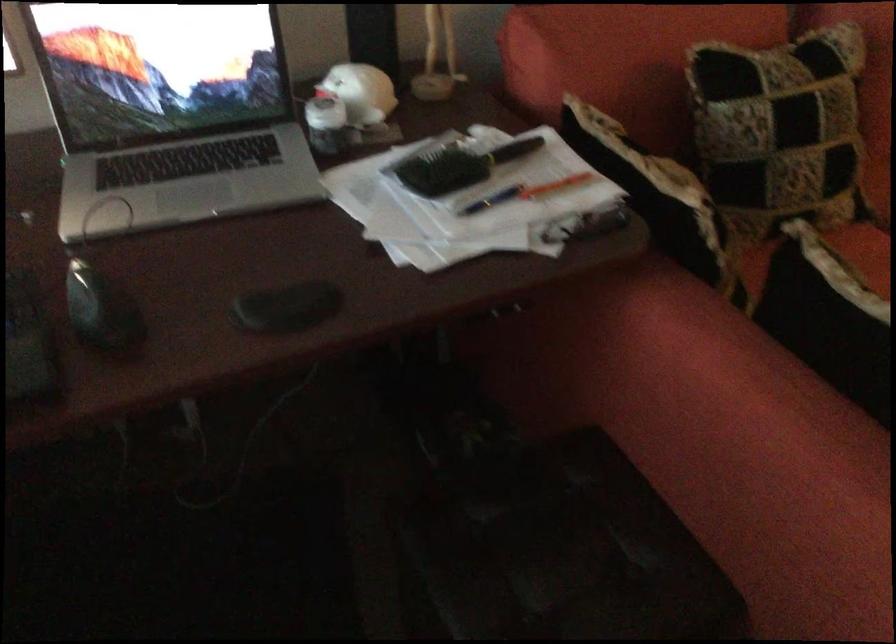
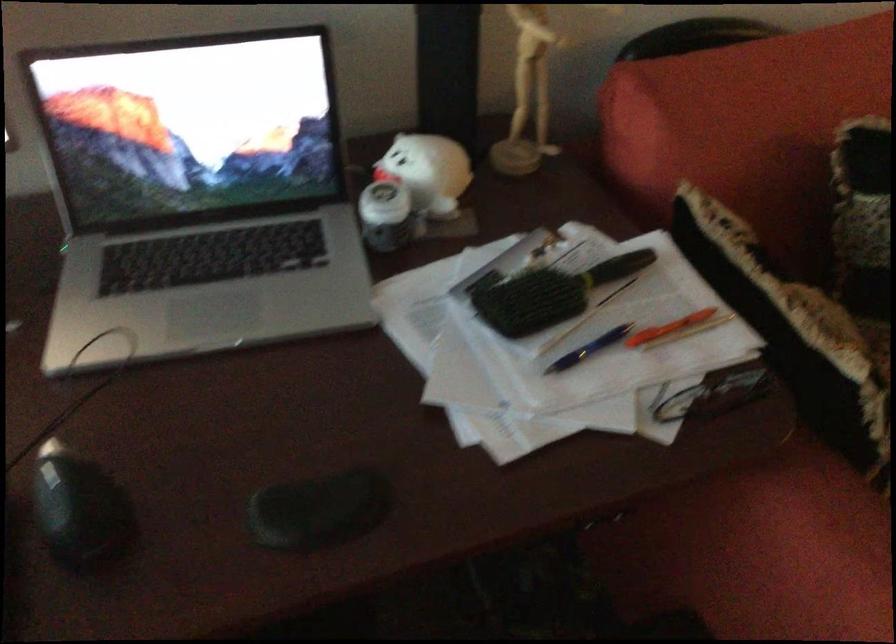
Locate, in the second image, the point that corresponds to [513,147] in the first image.

(616, 267)